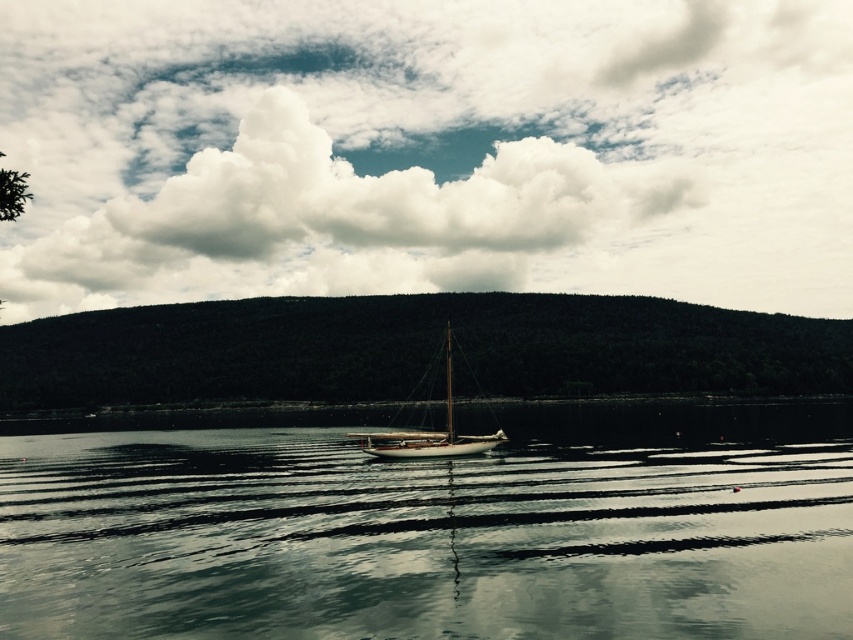
Can you confirm if white fluffy cloud at upper center is smaller than smooth dark water at center?

No, white fluffy cloud at upper center is not smaller than smooth dark water at center.

Is white fluffy cloud at upper center to the left of smooth dark water at center from the viewer's perspective?

Correct, you'll find white fluffy cloud at upper center to the left of smooth dark water at center.

At what (x,y) coordinates should I click in order to perform the action: click on white fluffy cloud at upper center. Please return your answer as a coordinate pair (x, y). Looking at the image, I should click on (427, 150).

Who is positioned more to the right, white fluffy cloud at upper center or wooden sailboat at center?

Positioned to the right is wooden sailboat at center.

Between white fluffy cloud at upper center and wooden sailboat at center, which one has more height?

With more height is white fluffy cloud at upper center.

Is point (299, 100) closer to viewer compared to point (392, 452)?

That is False.

You are a GUI agent. You are given a task and a screenshot of the screen. Output one action in this format:
    pyautogui.click(x=<x>, y=<y>)
    Task: Click on the white fluffy cloud at upper center
    The width and height of the screenshot is (853, 640).
    Given the screenshot: What is the action you would take?
    pyautogui.click(x=427, y=150)

Is smooth dark water at center to the right of wooden sailboat at center from the viewer's perspective?

Indeed, smooth dark water at center is positioned on the right side of wooden sailboat at center.

Can you confirm if smooth dark water at center is smaller than wooden sailboat at center?

Actually, smooth dark water at center might be larger than wooden sailboat at center.

The image size is (853, 640). What do you see at coordinates (436, 531) in the screenshot? I see `smooth dark water at center` at bounding box center [436, 531].

You are a GUI agent. You are given a task and a screenshot of the screen. Output one action in this format:
    pyautogui.click(x=<x>, y=<y>)
    Task: Click on the smooth dark water at center
    The height and width of the screenshot is (640, 853).
    Given the screenshot: What is the action you would take?
    pyautogui.click(x=436, y=531)